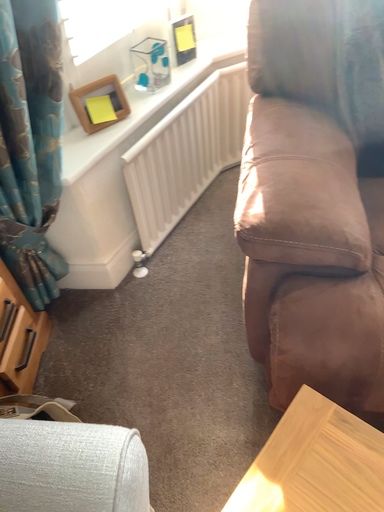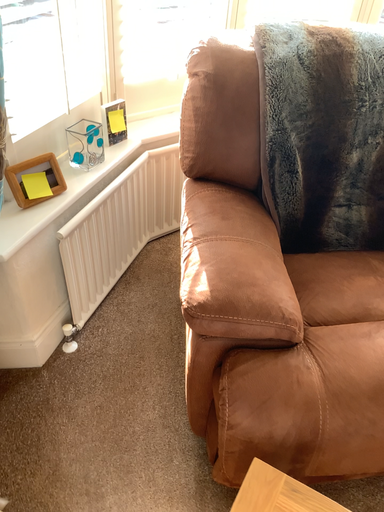
Question: How did the camera likely rotate when shooting the video?

Choices:
 (A) rotated left
 (B) rotated right

Answer: (B)